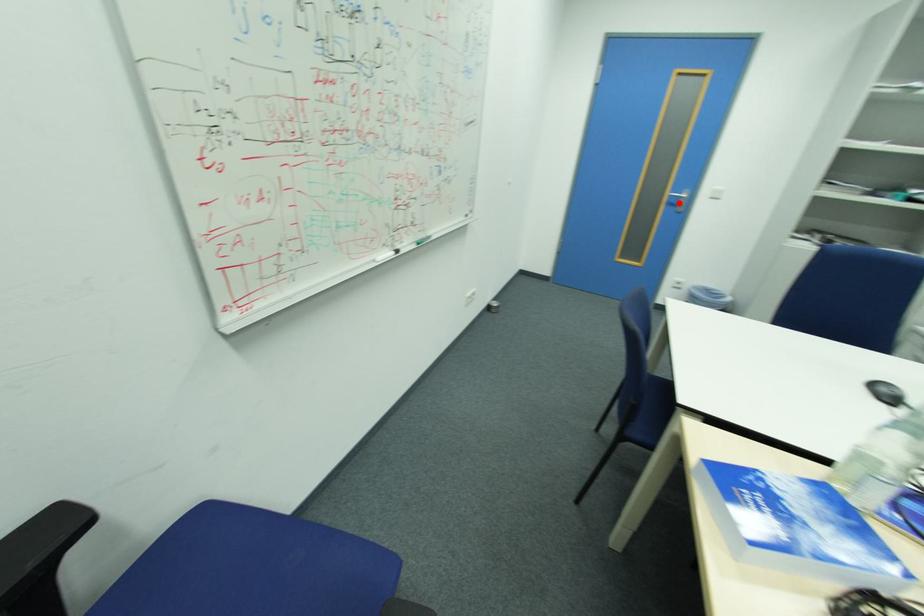
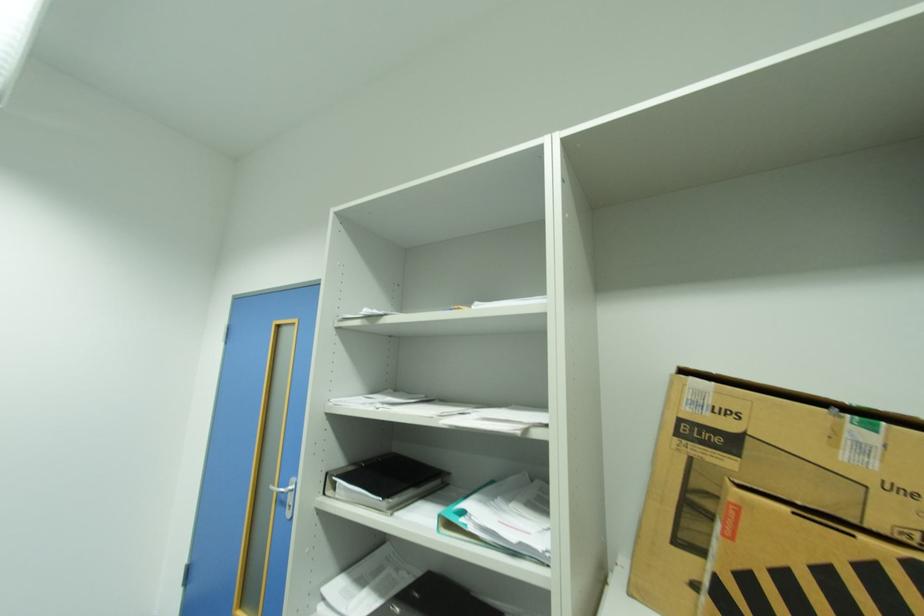
Question: I am providing you with two images of the same scene from different viewpoints. Image1 has a red point marked. In image2, the corresponding 3D location appears at what relative position? Reply with the corresponding letter.

Choices:
 (A) Closer
 (B) Farther

Answer: (B)